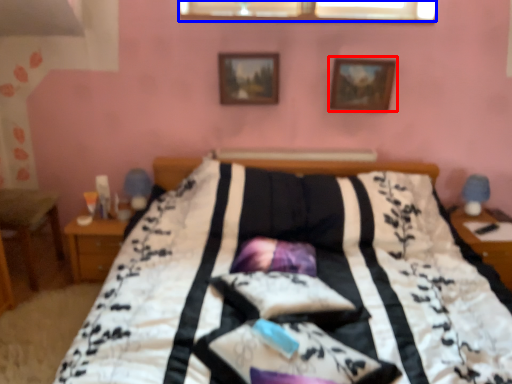
Question: Which point is closer to the camera, picture frame (highlighted by a red box) or window (highlighted by a blue box)?

Choices:
 (A) picture frame
 (B) window

Answer: (A)